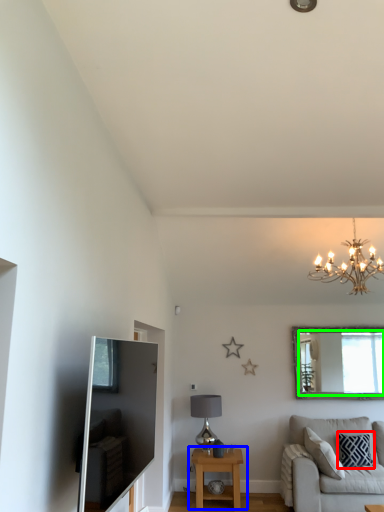
Question: Which is nearer to the pillow (highlighted by a red box)? table (highlighted by a blue box) or mirror (highlighted by a green box).

Choices:
 (A) table
 (B) mirror

Answer: (B)